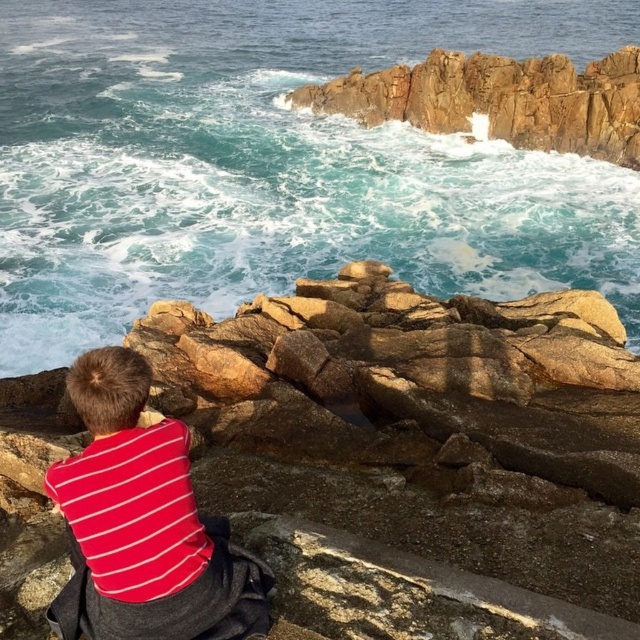
You are standing at point (182, 570) and want to walk to the ocean waves in the middle ground. Is the point (568, 522) between you and the ocean waves?

Point (568, 522) is behind point (182, 570), so it is not between you and the ocean waves. You can walk towards the ocean waves without passing through point (568, 522).

You are a geologist examining the coastal area. You notice the brown rough rock at center and the rusty rock at upper center. Which rock would you need to climb over to reach the other one?

The brown rough rock at center is smaller than the rusty rock at upper center. To reach the rusty rock at upper center from the brown rough rock at center, you would need to climb over the smaller brown rough rock at center.